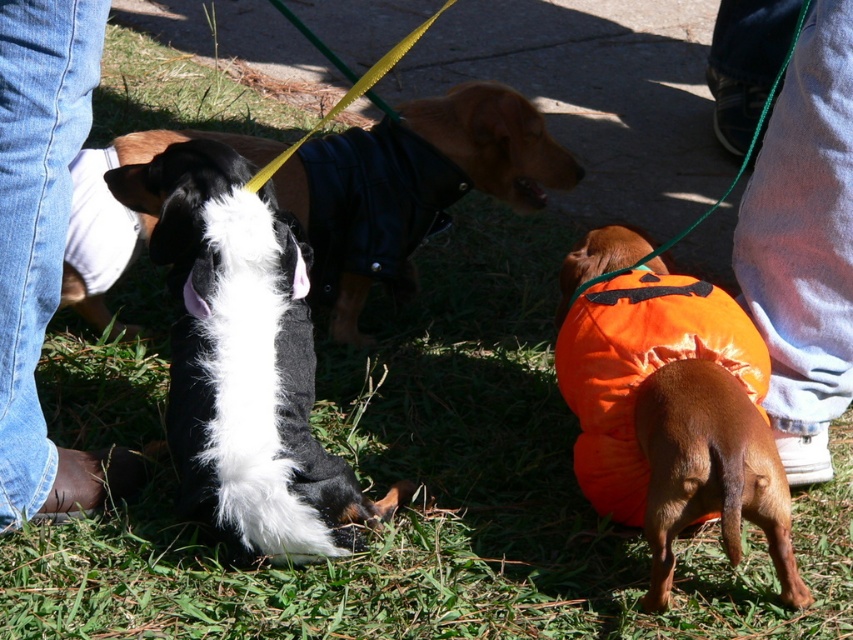
Who is lower down, jeans at lower left or orange fabric dog at lower right?

orange fabric dog at lower right is lower down.

Measure the distance between point (15, 480) and camera.

They are 7.55 feet apart.

Who is more distant from viewer, [6,460] or [778,541]?

The point [6,460] is more distant.

Locate an element on the screen. jeans at lower left is located at coordinates (42, 244).

Which is more to the left, black and white fur at center or black leather jacket at center?

black and white fur at center is more to the left.

Who is taller, black and white fur at center or black leather jacket at center?

black and white fur at center

Which is behind, point (239, 193) or point (525, 115)?

Point (525, 115)

You are a GUI agent. You are given a task and a screenshot of the screen. Output one action in this format:
    pyautogui.click(x=<x>, y=<y>)
    Task: Click on the black and white fur at center
    Image resolution: width=853 pixels, height=640 pixels.
    Given the screenshot: What is the action you would take?
    pyautogui.click(x=244, y=360)

Does orange fabric dog at center have a lesser height compared to orange fabric dog at lower right?

No.

Does orange fabric dog at center have a larger size compared to orange fabric dog at lower right?

Indeed, orange fabric dog at center has a larger size compared to orange fabric dog at lower right.

Who is more distant from viewer, (x=650, y=586) or (x=728, y=522)?

The point (x=650, y=586) is behind.

You are a GUI agent. You are given a task and a screenshot of the screen. Output one action in this format:
    pyautogui.click(x=<x>, y=<y>)
    Task: Click on the orange fabric dog at center
    
    Given the screenshot: What is the action you would take?
    pyautogui.click(x=701, y=465)